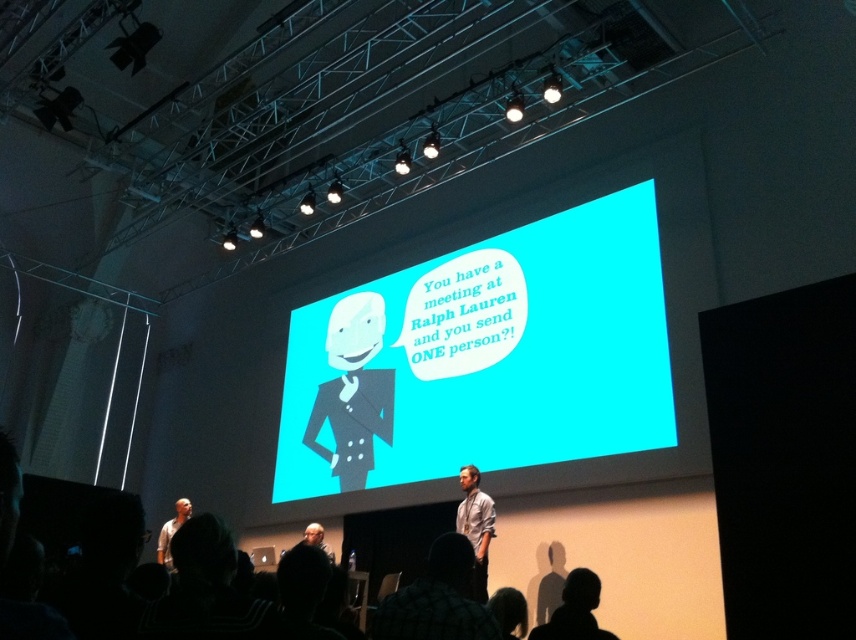
Does matte blue screen at center appear on the left side of light blue shirt at center?

In fact, matte blue screen at center is to the right of light blue shirt at center.

Between matte blue screen at center and light blue shirt at center, which one appears on the left side from the viewer's perspective?

light blue shirt at center is more to the left.

At what (x,y) coordinates should I click in order to perform the action: click on matte blue screen at center. Please return your answer as a coordinate pair (x, y). The width and height of the screenshot is (856, 640). Looking at the image, I should click on (484, 356).

Image resolution: width=856 pixels, height=640 pixels. In order to click on matte blue screen at center in this screenshot , I will do `click(484, 356)`.

Is matte black suit at center to the left of white matte shirt at lower left from the viewer's perspective?

Incorrect, matte black suit at center is not on the left side of white matte shirt at lower left.

Does matte black suit at center appear on the right side of white matte shirt at lower left?

Correct, you'll find matte black suit at center to the right of white matte shirt at lower left.

Find the location of a particular element. matte black suit at center is located at coordinates (354, 390).

At what (x,y) coordinates should I click in order to perform the action: click on matte black suit at center. Please return your answer as a coordinate pair (x, y). Looking at the image, I should click on pos(354,390).

Which is above, matte blue screen at center or matte black suit at center?

Positioned higher is matte blue screen at center.

Consider the image. Who is taller, matte blue screen at center or matte black suit at center?

matte black suit at center

Who is more forward, [524,266] or [354,394]?

Positioned in front is point [524,266].

Where is `matte blue screen at center`? The image size is (856, 640). matte blue screen at center is located at coordinates (484, 356).